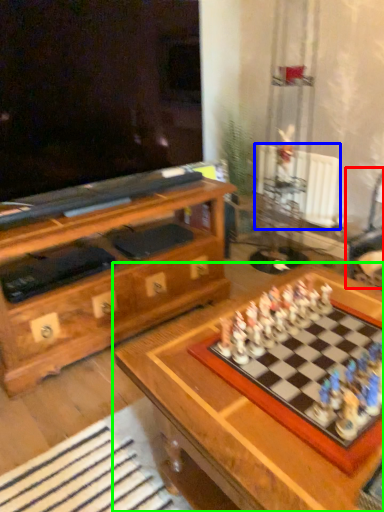
Question: Based on their relative distances, which object is farther from swivel chair (highlighted by a red box)? Choose from radiator (highlighted by a blue box) and table (highlighted by a green box).

Choices:
 (A) radiator
 (B) table

Answer: (B)